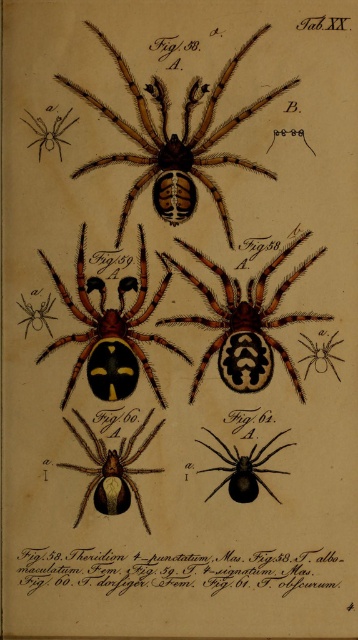
Can you confirm if brown glossy spider at upper center is positioned above brown glossy spider at lower left?

Correct, brown glossy spider at upper center is located above brown glossy spider at lower left.

Between point (142, 93) and point (137, 492), which one is positioned in front?

Point (137, 492) is in front.

The width and height of the screenshot is (358, 640). What are the coordinates of `brown glossy spider at upper center` in the screenshot? It's located at (175, 141).

How distant is shiny orange spider at center from brown glossy spider at lower left?

shiny orange spider at center and brown glossy spider at lower left are 4.65 inches apart from each other.

Is point (123, 371) closer to viewer compared to point (119, 488)?

No, it is behind (119, 488).

Is point (108, 364) positioned behind point (152, 432)?

No, (108, 364) is closer to viewer.

The width and height of the screenshot is (358, 640). What are the coordinates of `shiny orange spider at center` in the screenshot? It's located at (110, 332).

Who is positioned more to the left, black paper text at lower center or matte black spider at upper left?

matte black spider at upper left is more to the left.

Looking at this image, is black paper text at lower center below matte black spider at upper left?

Yes.

At what (x,y) coordinates should I click in order to perform the action: click on black paper text at lower center. Please return your answer as a coordinate pair (x, y). Looking at the image, I should click on (176, 570).